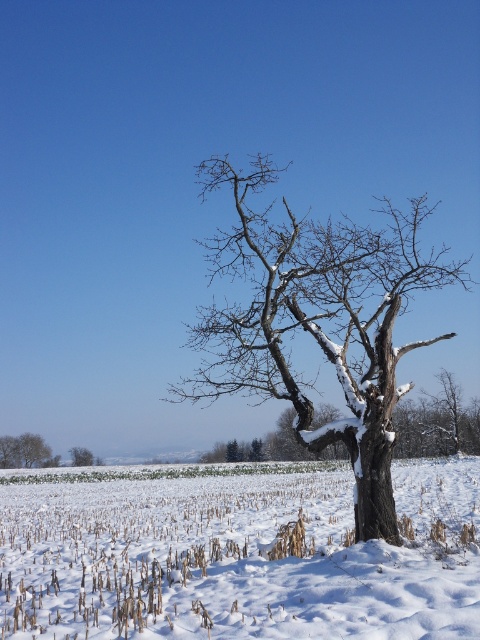
A drone is flying at a height of 10 meters above the ground. It needs to capture a photo of the point at coordinate point(236, 346) while avoiding collision with the tree. Given that the tree is 10.49 meters away from the point, is the drone at a safe distance?

The tree is 10.49 meters away from the point at coordinate point(236, 346). Since the drone is flying at 10 meters above the ground, it is slightly lower than the distance required to avoid collision. Therefore, the drone is not at a safe distance and may collide with the tree.